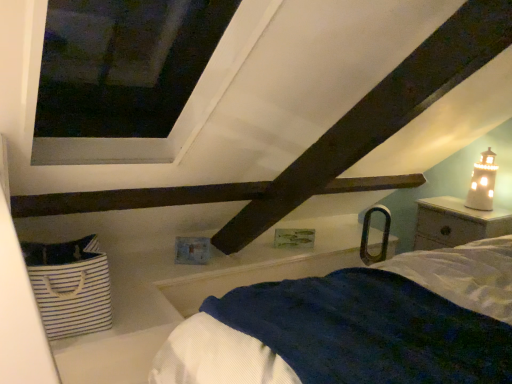
This screenshot has width=512, height=384. What are the coordinates of `vacant region in front of white ceramic lighthouse at upper right` in the screenshot? It's located at (488, 217).